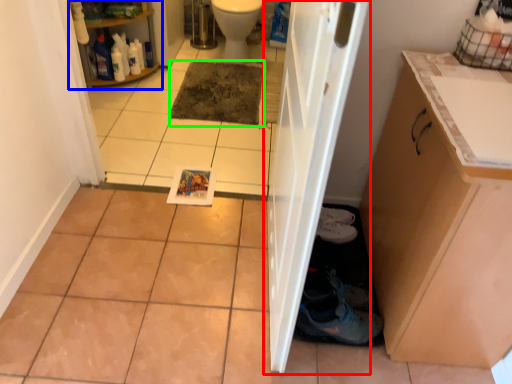
Question: Estimate the real-world distances between objects in this image. Which object is farther from door (highlighted by a red box), shelf (highlighted by a blue box) or mat (highlighted by a green box)?

Choices:
 (A) shelf
 (B) mat

Answer: (A)